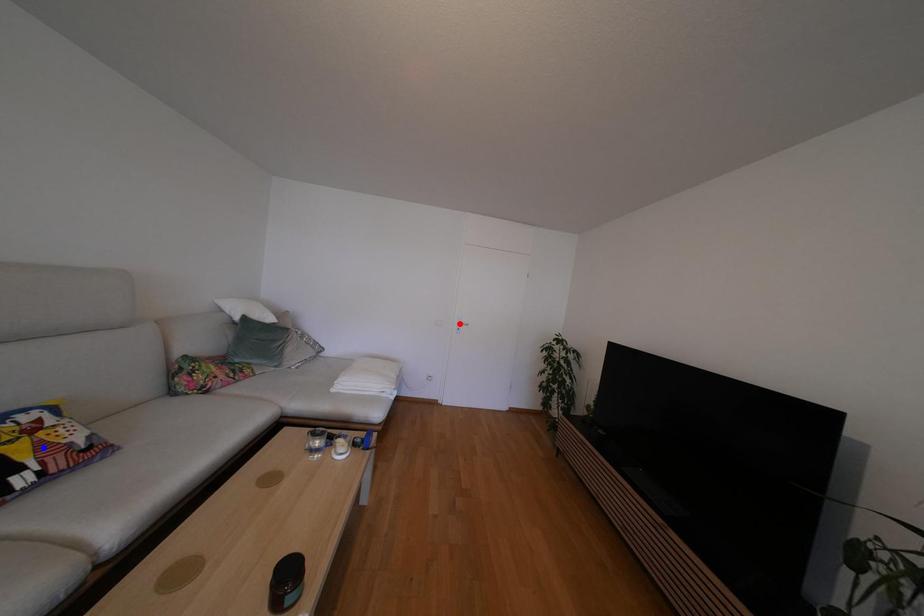
Question: In the image, two points are highlighted. Which point is nearer to the camera? Reply with the corresponding letter.

Choices:
 (A) blue point
 (B) red point

Answer: (A)